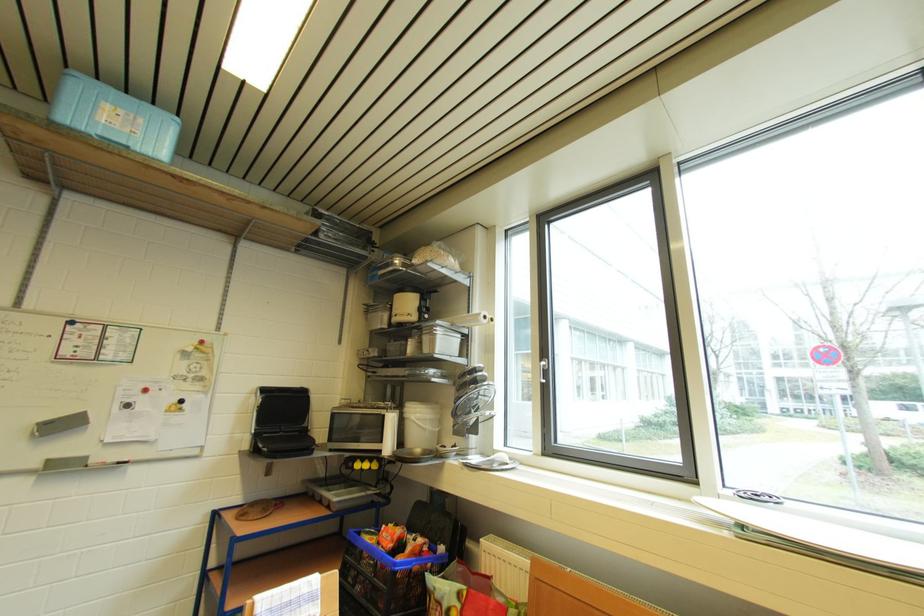
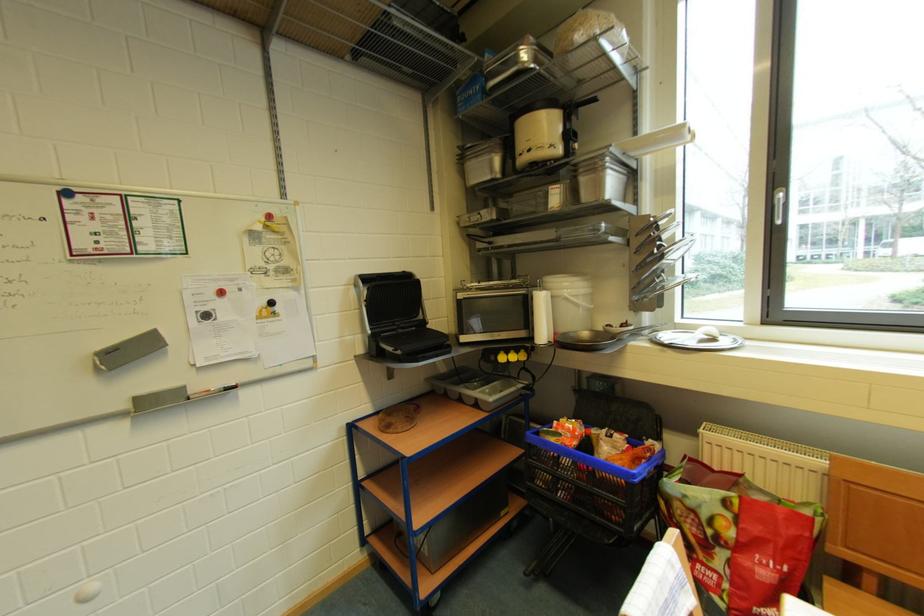
Find the pixel in the second image that matches [358,468] in the first image.

(500, 361)